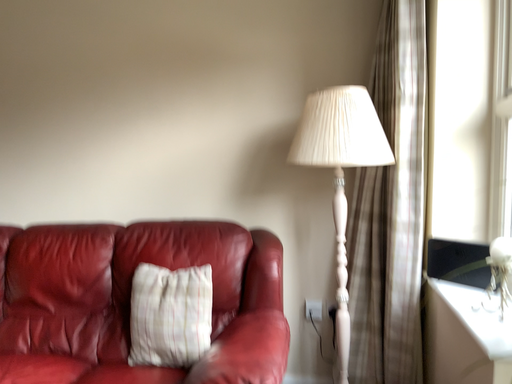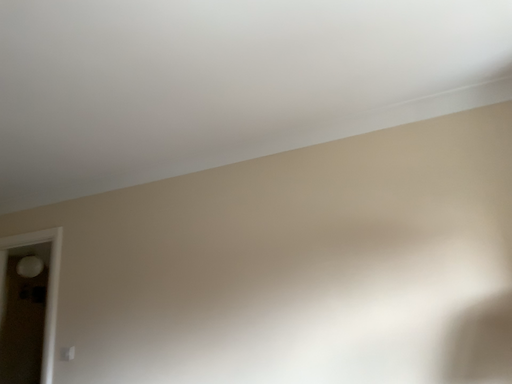
Question: Which way did the camera rotate in the video?

Choices:
 (A) rotated downward
 (B) rotated upward

Answer: (B)